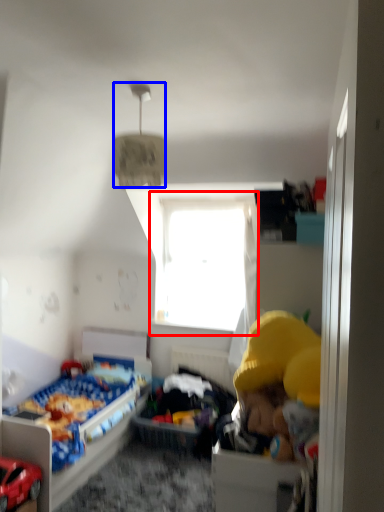
Question: Which point is further to the camera, window (highlighted by a red box) or lamp (highlighted by a blue box)?

Choices:
 (A) window
 (B) lamp

Answer: (A)